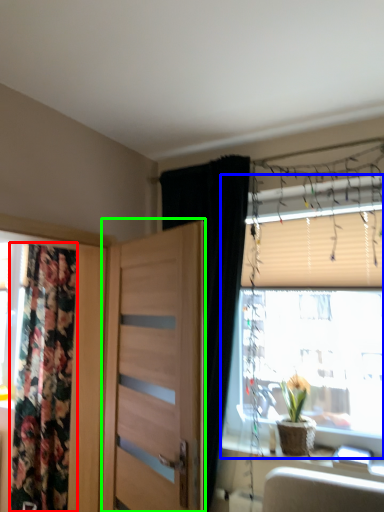
Question: Which object is positioned farthest from curtain (highlighted by a red box)? Select from window (highlighted by a blue box) and door (highlighted by a green box).

Choices:
 (A) window
 (B) door

Answer: (A)